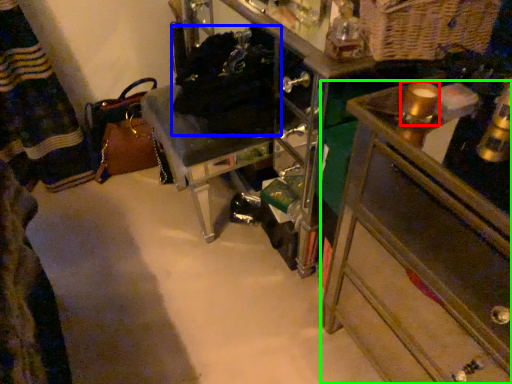
Question: Which object is the farthest from beverage (highlighted by a red box)? Choose among these: laundry (highlighted by a blue box) or chest of drawers (highlighted by a green box).

Choices:
 (A) laundry
 (B) chest of drawers

Answer: (A)